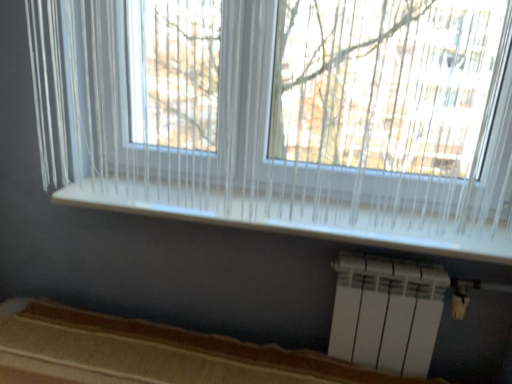
Question: From a real-world perspective, is white plastic radiator at lower right positioned over brown fabric bed frame at lower center based on gravity?

Choices:
 (A) no
 (B) yes

Answer: (B)

Question: From the image's perspective, is white plastic radiator at lower right over brown fabric bed frame at lower center?

Choices:
 (A) no
 (B) yes

Answer: (B)

Question: Could you tell me if white plastic radiator at lower right is facing brown fabric bed frame at lower center?

Choices:
 (A) no
 (B) yes

Answer: (A)

Question: Can you confirm if white plastic radiator at lower right is wider than brown fabric bed frame at lower center?

Choices:
 (A) no
 (B) yes

Answer: (A)

Question: Is brown fabric bed frame at lower center surrounded by white plastic radiator at lower right?

Choices:
 (A) no
 (B) yes

Answer: (A)

Question: Can you confirm if white plastic radiator at lower right is shorter than brown fabric bed frame at lower center?

Choices:
 (A) no
 (B) yes

Answer: (B)

Question: From a real-world perspective, is white translucent curtain at upper center on white plastic radiator at lower right?

Choices:
 (A) yes
 (B) no

Answer: (A)

Question: Is white translucent curtain at upper center closer to camera compared to white plastic radiator at lower right?

Choices:
 (A) yes
 (B) no

Answer: (A)

Question: From the image's perspective, is white translucent curtain at upper center located beneath white plastic radiator at lower right?

Choices:
 (A) yes
 (B) no

Answer: (B)

Question: Does white translucent curtain at upper center turn towards white plastic radiator at lower right?

Choices:
 (A) no
 (B) yes

Answer: (A)

Question: Is white translucent curtain at upper center bigger than white plastic radiator at lower right?

Choices:
 (A) yes
 (B) no

Answer: (A)

Question: Considering the relative positions of white translucent curtain at upper center and white plastic radiator at lower right in the image provided, is white translucent curtain at upper center to the right of white plastic radiator at lower right from the viewer's perspective?

Choices:
 (A) no
 (B) yes

Answer: (A)

Question: Does white translucent curtain at upper center lie in front of brown fabric bed frame at lower center?

Choices:
 (A) no
 (B) yes

Answer: (A)